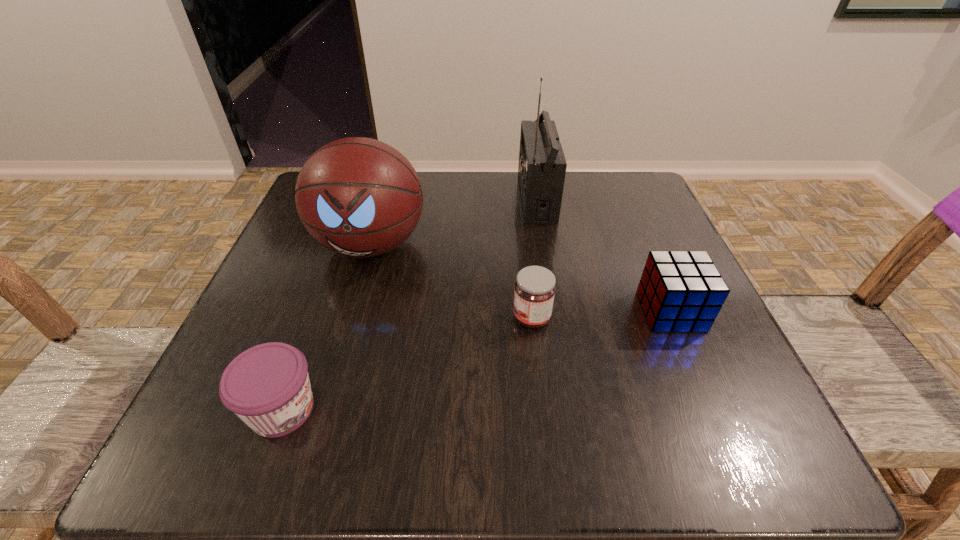
This screenshot has height=540, width=960. In order to click on free point between the radio receiver and the basketball in this screenshot , I will do `click(453, 221)`.

Where is `vacant area between the farther jam and the basketball`? The width and height of the screenshot is (960, 540). vacant area between the farther jam and the basketball is located at coordinates (451, 281).

Image resolution: width=960 pixels, height=540 pixels. What are the coordinates of `free space between the fourth shortest object and the nearest object` in the screenshot? It's located at (326, 327).

Where is `vacant region between the tallest object and the farther jam`? vacant region between the tallest object and the farther jam is located at coordinates (534, 258).

Where is `unoccupied area between the left jam and the basketball`? Image resolution: width=960 pixels, height=540 pixels. unoccupied area between the left jam and the basketball is located at coordinates pyautogui.click(x=326, y=327).

Image resolution: width=960 pixels, height=540 pixels. In order to click on vacant region between the farther jam and the rightmost object in this screenshot , I will do `click(601, 315)`.

Choose which object is the third nearest neighbor to the tallest object. Please provide its 2D coordinates. Your answer should be formatted as a tuple, i.e. [(x, y)], where the tuple contains the x and y coordinates of a point satisfying the conditions above.

[(534, 293)]

At what (x,y) coordinates should I click in order to perform the action: click on object that is the second closest one to the cube. Please return your answer as a coordinate pair (x, y). Looking at the image, I should click on (542, 166).

Find the location of a particular element. vacant area that satisfies the following two spatial constraints: 1. on the front panel of the rightmost object; 2. on the left side of the radio receiver is located at coordinates (555, 311).

You are a GUI agent. You are given a task and a screenshot of the screen. Output one action in this format:
    pyautogui.click(x=<x>, y=<y>)
    Task: Click on the vacant area that satisfies the following two spatial constraints: 1. on the front panel of the tallest object; 2. on the front side of the basketball
    This screenshot has width=960, height=540.
    Given the screenshot: What is the action you would take?
    pyautogui.click(x=544, y=245)